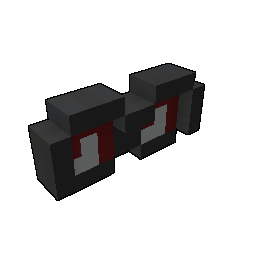
The width and height of the screenshot is (256, 256). I want to click on light gray accents, so click(89, 159), click(159, 125).